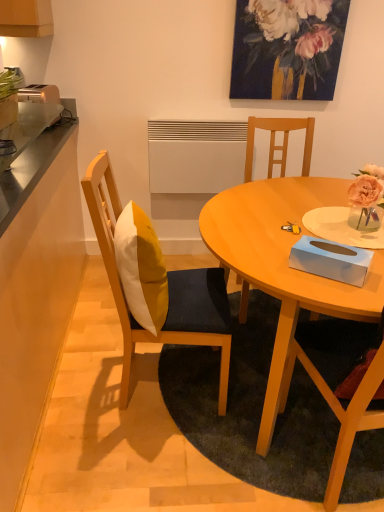
This screenshot has width=384, height=512. What do you see at coordinates (343, 411) in the screenshot?
I see `wooden chair at right, which is counted as the 1th chair, starting from the right` at bounding box center [343, 411].

This screenshot has height=512, width=384. Describe the element at coordinates (251, 408) in the screenshot. I see `dark gray carpet at lower center` at that location.

Find the location of a particular element. wooden chair with cushion at left, which is counted as the 3th chair, starting from the right is located at coordinates (168, 289).

In order to face metallic stainless steel counter at left, the 1th counter top when ordered from left to right, should I rotate leftwards or rightwards?

A 25.678 degree turn to the left will do.

What do you see at coordinates (284, 265) in the screenshot?
I see `matte wood table at center` at bounding box center [284, 265].

In order to face wooden chair at center, arranged as the 2th chair when viewed from the right, should I rotate leftwards or rightwards?

A 12.014 degree turn to the right will do.

The image size is (384, 512). Describe the element at coordinates (33, 164) in the screenshot. I see `metallic stainless steel counter top at left, the second counter top positioned from the left` at that location.

In order to face metallic stainless steel counter top at left, the second counter top positioned from the left, should I rotate leftwards or rightwards?

Rotate left and turn 23.942 degrees.

Locate an element on the screen. The width and height of the screenshot is (384, 512). wooden chair at right, which appears as the 3th chair when viewed from the left is located at coordinates (343, 411).

What's the angular difference between metallic silver toaster at left and dark gray carpet at lower center's facing directions?

The angle between the facing direction of metallic silver toaster at left and the facing direction of dark gray carpet at lower center is 95.1 degrees.

From a real-world perspective, is metallic silver toaster at left positioned under dark gray carpet at lower center based on gravity?

Incorrect, from a real-world perspective, metallic silver toaster at left is higher than dark gray carpet at lower center.

Is metallic silver toaster at left positioned with its back to dark gray carpet at lower center?

That's not correct — metallic silver toaster at left is not looking away from dark gray carpet at lower center.

From a real-world perspective, is matte wood table at center located higher than metallic stainless steel counter at left, the 1th counter top when ordered from left to right?

No, from a real-world perspective, matte wood table at center is not above metallic stainless steel counter at left, the 1th counter top when ordered from left to right.

Locate an element on the screen. This screenshot has width=384, height=512. the 2nd counter top in front of the matte wood table at center is located at coordinates (35, 289).

What's the angular difference between matte wood table at center and metallic stainless steel counter at left, the 1th counter top when ordered from left to right,'s facing directions?

matte wood table at center and metallic stainless steel counter at left, the 1th counter top when ordered from left to right, are facing 179 degrees away from each other.

Is matte wood table at center located outside metallic stainless steel counter at left, the second counter top viewed from the right?

matte wood table at center is positioned outside metallic stainless steel counter at left, the second counter top viewed from the right.

Which object is closer to the camera, painted floral arrangement at upper center or metallic stainless steel counter at left, the second counter top viewed from the right?

metallic stainless steel counter at left, the second counter top viewed from the right, is more forward.

From the picture: From the image's perspective, which one is positioned higher, painted floral arrangement at upper center or metallic stainless steel counter at left, the 1th counter top when ordered from left to right?

painted floral arrangement at upper center appears higher in the image.

Is metallic stainless steel counter at left, the second counter top viewed from the right, at the back of painted floral arrangement at upper center?

No, painted floral arrangement at upper center's orientation is not away from metallic stainless steel counter at left, the second counter top viewed from the right.

Can you confirm if painted floral arrangement at upper center is smaller than metallic stainless steel counter at left, the 1th counter top when ordered from left to right?

Yes, painted floral arrangement at upper center is smaller than metallic stainless steel counter at left, the 1th counter top when ordered from left to right.

Between wooden chair at center, positioned as the second chair in left-to-right order, and wooden chair at right, which is counted as the 1th chair, starting from the right, which one has less height?

Standing shorter between the two is wooden chair at center, positioned as the second chair in left-to-right order.

From the image's perspective, is wooden chair at center, positioned as the second chair in left-to-right order, beneath wooden chair at right, which is counted as the 1th chair, starting from the right?

Actually, wooden chair at center, positioned as the second chair in left-to-right order, appears above wooden chair at right, which is counted as the 1th chair, starting from the right, in the image.

What's the angular difference between wooden chair at center, positioned as the second chair in left-to-right order, and wooden chair at right, which appears as the 3th chair when viewed from the left,'s facing directions?

There is a 177-degree angle between the facing directions of wooden chair at center, positioned as the second chair in left-to-right order, and wooden chair at right, which appears as the 3th chair when viewed from the left.

Could you tell me if wooden chair at center, positioned as the second chair in left-to-right order, is turned towards wooden chair at right, which is counted as the 1th chair, starting from the right?

Yes.

Is metallic stainless steel counter at left, the second counter top viewed from the right, in front of metallic stainless steel counter top at left, the second counter top positioned from the left?

Yes, metallic stainless steel counter at left, the second counter top viewed from the right, is closer to the viewer.

Is metallic stainless steel counter at left, the 1th counter top when ordered from left to right, inside the boundaries of metallic stainless steel counter top at left, which appears as the 1th counter top when viewed from the right, or outside?

metallic stainless steel counter at left, the 1th counter top when ordered from left to right, is not inside metallic stainless steel counter top at left, which appears as the 1th counter top when viewed from the right, it's outside.

Considering the sizes of objects metallic stainless steel counter at left, the second counter top viewed from the right, and metallic stainless steel counter top at left, which appears as the 1th counter top when viewed from the right, in the image provided, who is bigger, metallic stainless steel counter at left, the second counter top viewed from the right, or metallic stainless steel counter top at left, which appears as the 1th counter top when viewed from the right,?

With larger size is metallic stainless steel counter at left, the second counter top viewed from the right.

Which of these two, metallic stainless steel counter at left, the second counter top viewed from the right, or metallic stainless steel counter top at left, which appears as the 1th counter top when viewed from the right, stands taller?

metallic stainless steel counter at left, the second counter top viewed from the right, is taller.

Can you confirm if matte wood table at center is thinner than metallic stainless steel counter top at left, the second counter top positioned from the left?

Incorrect, the width of matte wood table at center is not less than that of metallic stainless steel counter top at left, the second counter top positioned from the left.

Is matte wood table at center with metallic stainless steel counter top at left, the second counter top positioned from the left?

No, matte wood table at center is not beside metallic stainless steel counter top at left, the second counter top positioned from the left.

From the image's perspective, between matte wood table at center and metallic stainless steel counter top at left, the second counter top positioned from the left, which one is located above?

metallic stainless steel counter top at left, the second counter top positioned from the left, is shown above in the image.

In terms of height, does matte wood table at center look taller or shorter compared to metallic stainless steel counter top at left, the second counter top positioned from the left?

Clearly, matte wood table at center is taller compared to metallic stainless steel counter top at left, the second counter top positioned from the left.

You are a GUI agent. You are given a task and a screenshot of the screen. Output one action in this format:
    pyautogui.click(x=<x>, y=<y>)
    Task: Click on the 1st chair positioned below the wooden chair at center, arranged as the 2th chair when viewed from the right (from the image's perspective)
    This screenshot has height=512, width=384.
    Given the screenshot: What is the action you would take?
    pyautogui.click(x=168, y=289)

How many degrees apart are the facing directions of wooden chair with cushion at left, which is counted as the 3th chair, starting from the right, and wooden chair at center, positioned as the second chair in left-to-right order?

wooden chair with cushion at left, which is counted as the 3th chair, starting from the right, and wooden chair at center, positioned as the second chair in left-to-right order, are facing 86.9 degrees away from each other.

Based on the photo, can you confirm if wooden chair with cushion at left, which is counted as the 3th chair, starting from the right, is positioned to the left of wooden chair at center, arranged as the 2th chair when viewed from the right?

Correct, you'll find wooden chair with cushion at left, which is counted as the 3th chair, starting from the right, to the left of wooden chair at center, arranged as the 2th chair when viewed from the right.

In the scene shown: From a real-world perspective, is wooden chair with cushion at left, which is counted as the 3th chair, starting from the right, physically below wooden chair at center, arranged as the 2th chair when viewed from the right?

No, from a real-world perspective, wooden chair with cushion at left, which is counted as the 3th chair, starting from the right, is not below wooden chair at center, arranged as the 2th chair when viewed from the right.

At what (x,y) coordinates should I click in order to perform the action: click on mat in front of the metallic silver toaster at left. Please return your answer as a coordinate pair (x, y). The image size is (384, 512). Looking at the image, I should click on (251, 408).

Locate an element on the screen. This screenshot has width=384, height=512. counter top that is the 2nd object to the left of the matte wood table at center, starting at the anchor is located at coordinates (35, 289).

Looking at the image, which one is located further to wooden chair at center, arranged as the 2th chair when viewed from the right, wooden chair with cushion at left, acting as the 1th chair starting from the left, or yellow fabric pillow at center?

Among the two, yellow fabric pillow at center is located further to wooden chair at center, arranged as the 2th chair when viewed from the right.

Estimate the real-world distances between objects in this image. Which object is closer to dark gray carpet at lower center, wooden chair with cushion at left, acting as the 1th chair starting from the left, or wooden chair at right, which appears as the 3th chair when viewed from the left?

wooden chair at right, which appears as the 3th chair when viewed from the left, is closer to dark gray carpet at lower center.

Considering their positions, is metallic stainless steel counter top at left, which appears as the 1th counter top when viewed from the right, positioned closer to metallic stainless steel counter at left, the 1th counter top when ordered from left to right, than metallic silver toaster at left?

metallic stainless steel counter top at left, which appears as the 1th counter top when viewed from the right, is closer to metallic stainless steel counter at left, the 1th counter top when ordered from left to right.

From the image, which object appears to be nearer to matte wood table at center, wooden chair at center, arranged as the 2th chair when viewed from the right, or wooden chair with cushion at left, which is counted as the 3th chair, starting from the right?

Among the two, wooden chair with cushion at left, which is counted as the 3th chair, starting from the right, is located nearer to matte wood table at center.

Based on their spatial positions, is metallic stainless steel counter top at left, which appears as the 1th counter top when viewed from the right, or wooden chair with cushion at left, which is counted as the 3th chair, starting from the right, closer to matte wood table at center?

Among the two, wooden chair with cushion at left, which is counted as the 3th chair, starting from the right, is located nearer to matte wood table at center.

Considering their positions, is metallic stainless steel counter at left, the 1th counter top when ordered from left to right, positioned closer to painted floral arrangement at upper center than yellow fabric pillow at center?

metallic stainless steel counter at left, the 1th counter top when ordered from left to right, is positioned closer to the anchor painted floral arrangement at upper center.

From the image, which object appears to be farther from painted floral arrangement at upper center, wooden chair at right, which appears as the 3th chair when viewed from the left, or wooden chair at center, positioned as the second chair in left-to-right order?

Among the two, wooden chair at right, which appears as the 3th chair when viewed from the left, is located further to painted floral arrangement at upper center.

Considering their positions, is wooden chair at right, which appears as the 3th chair when viewed from the left, positioned further to metallic stainless steel counter top at left, which appears as the 1th counter top when viewed from the right, than wooden chair with cushion at left, which is counted as the 3th chair, starting from the right?

Based on the image, wooden chair at right, which appears as the 3th chair when viewed from the left, appears to be further to metallic stainless steel counter top at left, which appears as the 1th counter top when viewed from the right.

The width and height of the screenshot is (384, 512). In order to click on pillow between wooden chair at right, which is counted as the 1th chair, starting from the right, and wooden chair at center, positioned as the second chair in left-to-right order, from front to back in this screenshot , I will do `click(141, 268)`.

Where is `mat situated between metallic stainless steel counter at left, the second counter top viewed from the right, and wooden chair at center, arranged as the 2th chair when viewed from the right, from left to right`? This screenshot has width=384, height=512. mat situated between metallic stainless steel counter at left, the second counter top viewed from the right, and wooden chair at center, arranged as the 2th chair when viewed from the right, from left to right is located at coordinates (251, 408).

This screenshot has height=512, width=384. I want to click on floral arrangement situated between metallic silver toaster at left and matte wood table at center from left to right, so click(x=294, y=40).

This screenshot has height=512, width=384. I want to click on mat between metallic stainless steel counter top at left, the second counter top positioned from the left, and wooden chair at right, which is counted as the 1th chair, starting from the right, so click(251, 408).